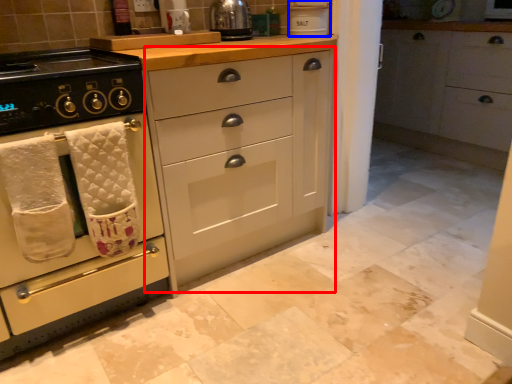
Question: Which object appears closest to the camera in this image, cabinetry (highlighted by a red box) or appliance (highlighted by a blue box)?

Choices:
 (A) cabinetry
 (B) appliance

Answer: (A)